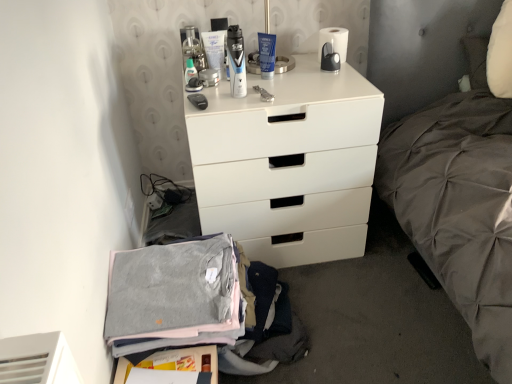
Locate an element on the screen. vacant area situated to the left side of white matte toilet paper at upper center is located at coordinates (281, 69).